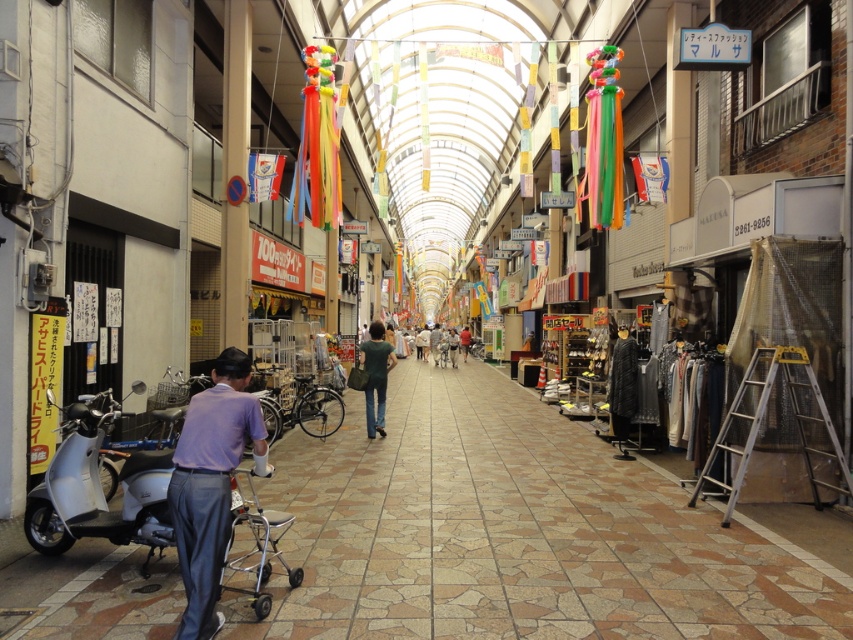
In the shopping arcade scene, there is a purple fabric shirt at left and a point marked at coordinates (x=210, y=484). Which object corresponds to the point?

The purple fabric shirt at left is represented by the point at coordinates (x=210, y=484).

You are a customer in the shopping arcade and want to reach the silver metallic ladder at lower right to retrieve an item. However, there is a purple fabric shirt at left blocking your path. Can you walk around it? Explain why.

The purple fabric shirt at left has a lesser height compared to the silver metallic ladder at lower right. Since the shirt is shorter, you can likely walk around it to reach the ladder.

Based on the scene description, what object is located at the coordinates point (210, 484)?

The purple fabric shirt at left is located at point (210, 484).